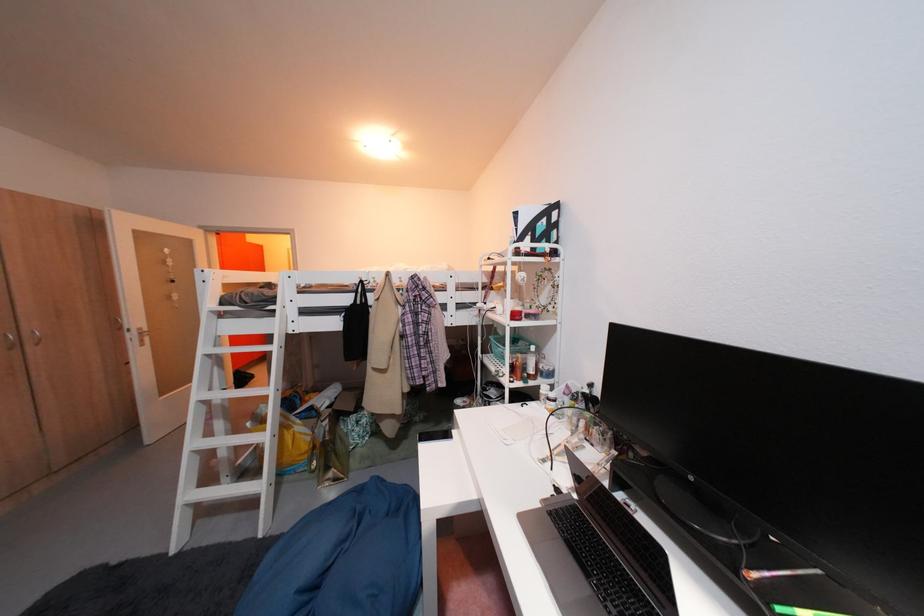
Locate an element on the screen. Image resolution: width=924 pixels, height=616 pixels. small white jar is located at coordinates coord(531,363).